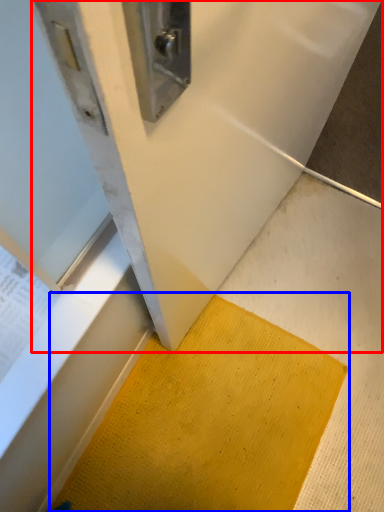
Question: Which object is closer to the camera taking this photo, wide (highlighted by a red box) or doormat (highlighted by a blue box)?

Choices:
 (A) wide
 (B) doormat

Answer: (A)